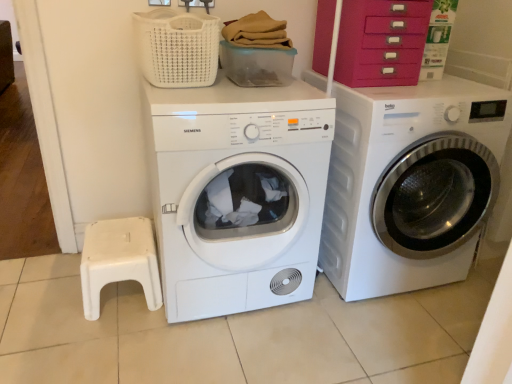
Locate an element on the screen. free space above white matte dryer at center, positioned as the second washing machine in right-to-left order (from a real-world perspective) is located at coordinates (249, 94).